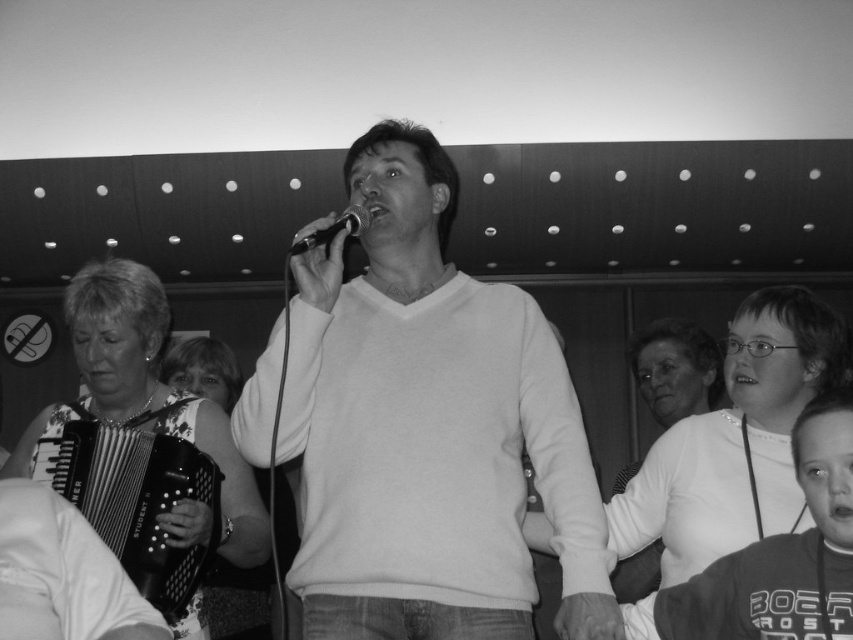
You are standing in the room where the musical performance is happening. You want to approach the smooth white sweater at center to hand it to the performer. Which direction should you move relative to your current position?

The smooth white sweater at center is located at point (428, 428) in the 2D image coordinates. Since the sweater is at the center of the image, you should move towards the central area of the room where the performer is standing to reach it.

Based on the photo, you are a photographer trying to capture a closeup shot of the central performer in this image. You need to ensure that both the smooth white sweater at center and the black metallic microphone at center are in focus. Given that your camera can only sharply focus on objects within a 30 cm range, will you be able to achieve this?

The smooth white sweater at center is 33.31 centimeters from the black metallic microphone at center. Since the distance exceeds the camera focus range of 30 cm, you cannot have both in focus simultaneously.